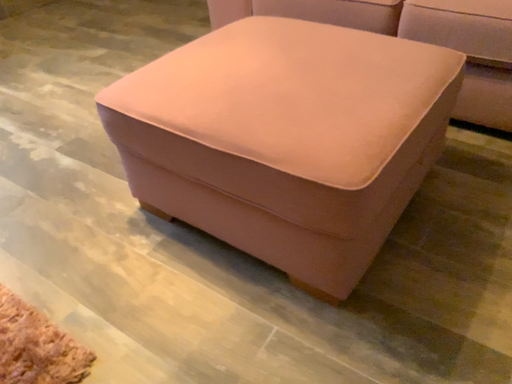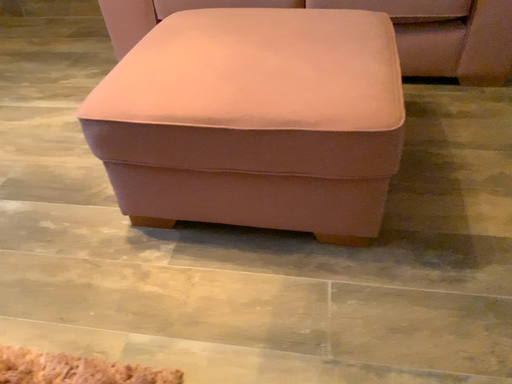
Question: Which way did the camera rotate in the video?

Choices:
 (A) rotated left
 (B) rotated right

Answer: (B)